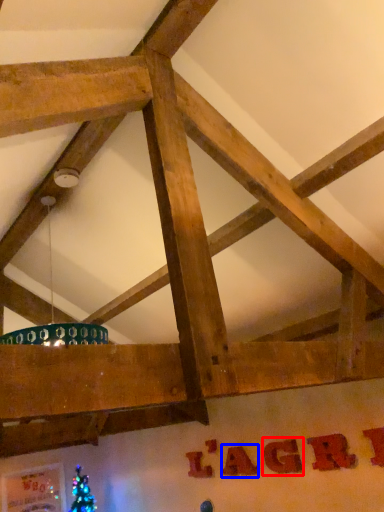
Question: Which object is closer to the camera taking this photo, letter (highlighted by a red box) or letter (highlighted by a blue box)?

Choices:
 (A) letter
 (B) letter

Answer: (A)